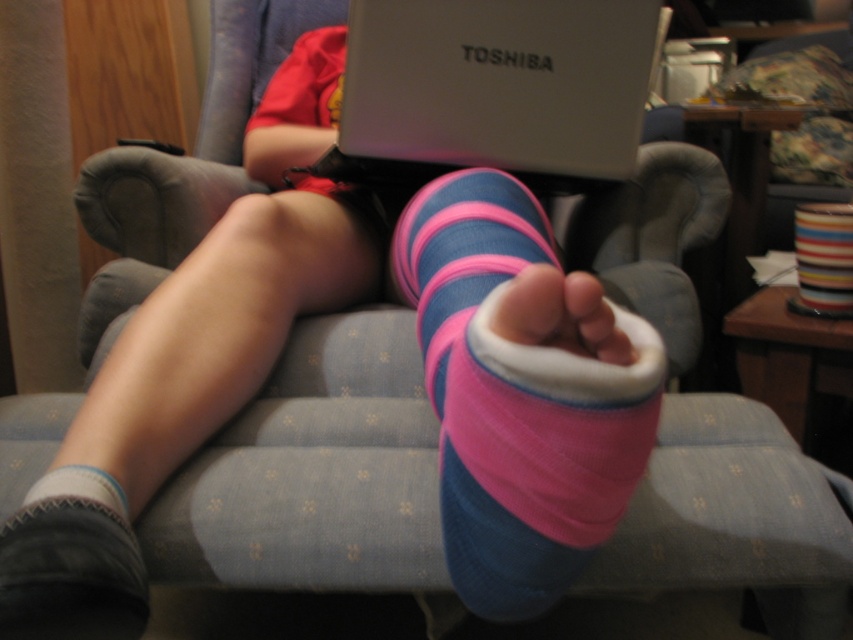
Is white plastic laptop at upper center positioned behind suede-like pink sock at lower left?

Yes, it is.

Between white plastic laptop at upper center and suede-like pink sock at lower left, which one appears on the right side from the viewer's perspective?

white plastic laptop at upper center is more to the right.

Is point (471, 109) closer to camera compared to point (28, 509)?

No.

Identify the location of white plastic laptop at upper center. (492, 88).

Does pink fabric sock at center lie behind white plastic laptop at upper center?

That is False.

Does pink fabric sock at center appear on the right side of white plastic laptop at upper center?

Correct, you'll find pink fabric sock at center to the right of white plastic laptop at upper center.

Describe the element at coordinates (521, 390) in the screenshot. I see `pink fabric sock at center` at that location.

Where is `pink fabric sock at center`? The height and width of the screenshot is (640, 853). pink fabric sock at center is located at coordinates tap(521, 390).

Does gray/soft fabric sock at lower left have a lesser width compared to suede-like pink sock at lower left?

No, gray/soft fabric sock at lower left is not thinner than suede-like pink sock at lower left.

From the picture: Does gray/soft fabric sock at lower left have a greater width compared to suede-like pink sock at lower left?

Yes.

Does point (160, 472) come behind point (79, 520)?

Yes, point (160, 472) is behind point (79, 520).

The height and width of the screenshot is (640, 853). Identify the location of gray/soft fabric sock at lower left. (171, 404).